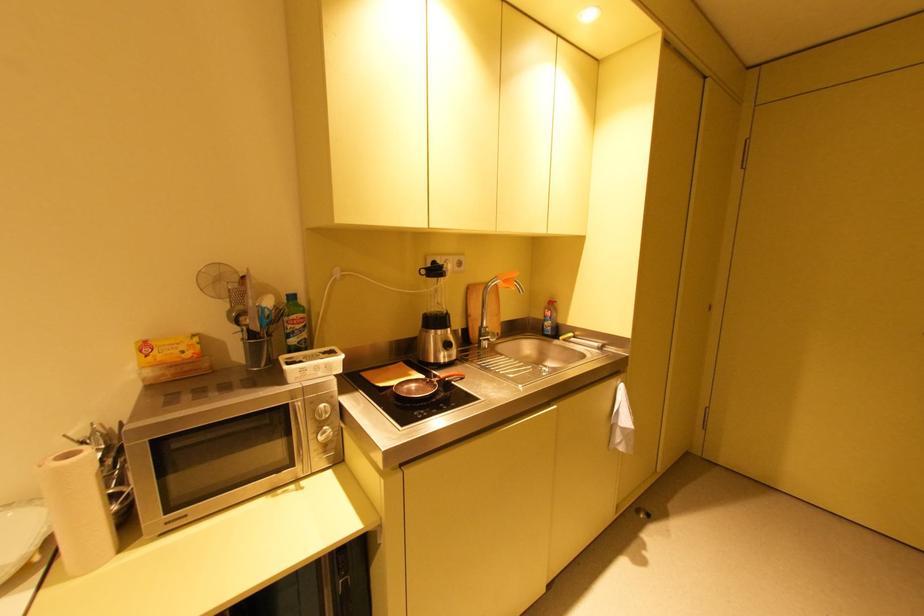
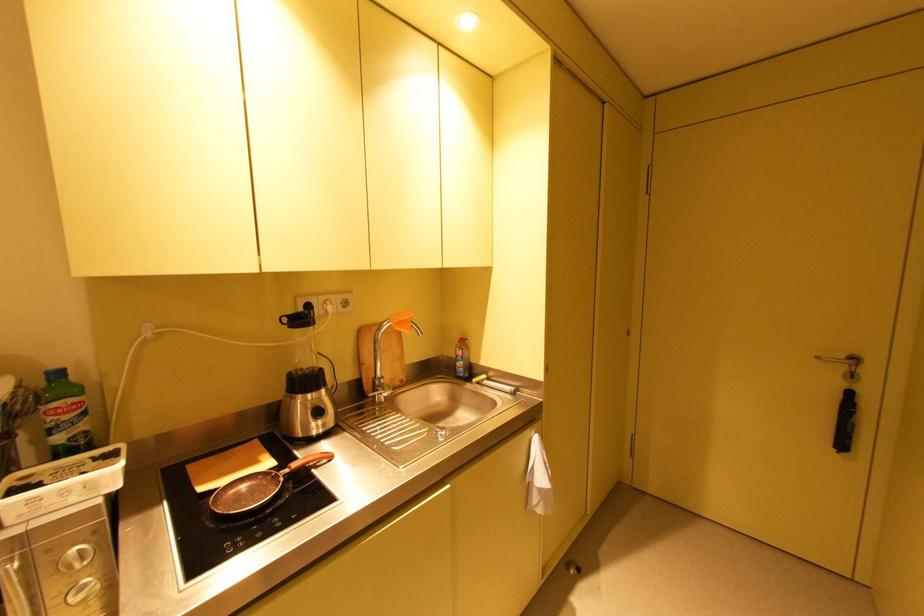
In a continuous first-person perspective shot, in which direction is the camera moving?

The cameraman walked toward right, forward.